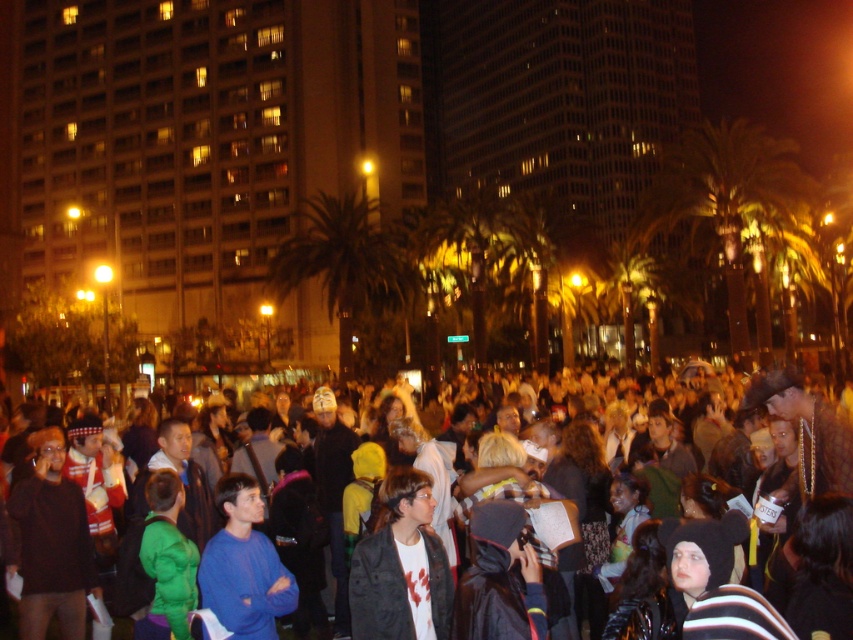
Does dark blue hoodie at center appear on the left side of blue fleece jacket at center?

No, dark blue hoodie at center is not to the left of blue fleece jacket at center.

Where is `dark blue hoodie at center`? The height and width of the screenshot is (640, 853). dark blue hoodie at center is located at coordinates (790, 449).

Where is `matte black jacket at center`? matte black jacket at center is located at coordinates (401, 566).

Who is more distant from viewer, (412, 592) or (405, 285)?

The point (405, 285) is behind.

You are a GUI agent. You are given a task and a screenshot of the screen. Output one action in this format:
    pyautogui.click(x=<x>, y=<y>)
    Task: Click on the matte black jacket at center
    The width and height of the screenshot is (853, 640).
    Given the screenshot: What is the action you would take?
    pyautogui.click(x=401, y=566)

Who is lower down, green leafy palm tree at center or blue fleece jacket at center?

blue fleece jacket at center

Looking at this image, is green leafy palm tree at center positioned at the back of blue fleece jacket at center?

Yes, green leafy palm tree at center is behind blue fleece jacket at center.

Which is in front, point (370, 291) or point (218, 490)?

Positioned in front is point (218, 490).

At what (x,y) coordinates should I click in order to perform the action: click on green leafy palm tree at center. Please return your answer as a coordinate pair (x, y). This screenshot has height=640, width=853. Looking at the image, I should click on (341, 262).